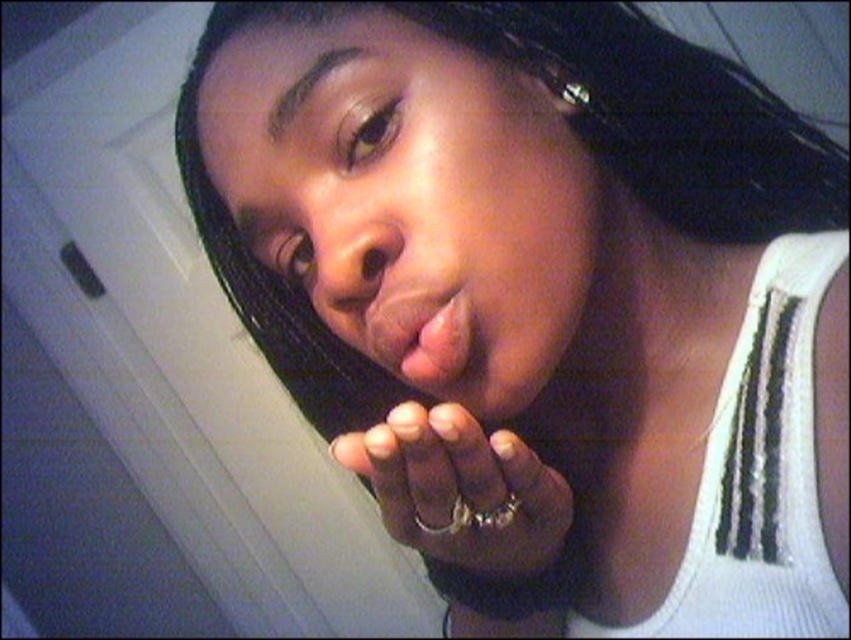
Question: Is smooth skin face at center to the left of metallic ring at center from the viewer's perspective?

Choices:
 (A) yes
 (B) no

Answer: (A)

Question: Among these objects, which one is farthest from the camera?

Choices:
 (A) smooth skin face at center
 (B) matte pink lips at center

Answer: (B)

Question: Does smooth skin face at center have a lesser width compared to matte pink lips at center?

Choices:
 (A) no
 (B) yes

Answer: (A)

Question: Which point is farther to the camera?

Choices:
 (A) smooth skin face at center
 (B) metallic ring at center

Answer: (A)

Question: Considering the real-world distances, which object is closest to the smooth skin face at center?

Choices:
 (A) matte pink lips at center
 (B) metallic ring at center

Answer: (A)

Question: Is smooth skin face at center positioned before matte pink lips at center?

Choices:
 (A) no
 (B) yes

Answer: (B)